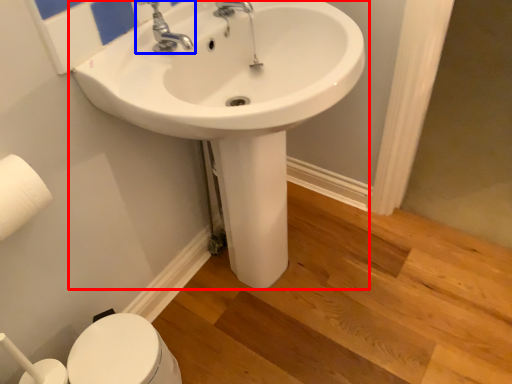
Question: Which object appears farthest to the camera in this image, sink (highlighted by a red box) or tap (highlighted by a blue box)?

Choices:
 (A) sink
 (B) tap

Answer: (B)